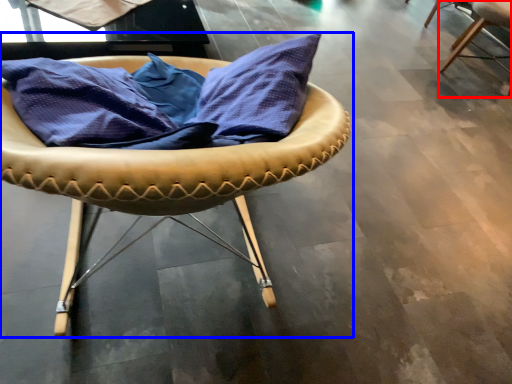
Question: Which point is closer to the camera, chair (highlighted by a red box) or chair (highlighted by a blue box)?

Choices:
 (A) chair
 (B) chair

Answer: (B)